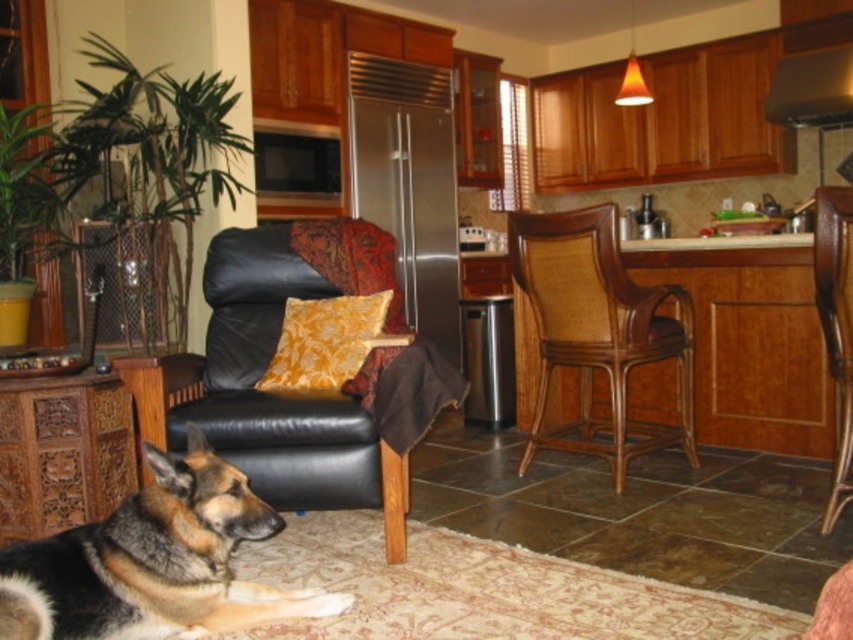
Does brown fur dog at lower left appear on the right side of brown woven wood chair at center?

No, brown fur dog at lower left is not to the right of brown woven wood chair at center.

Which is in front, point (22, 616) or point (645, 355)?

Point (22, 616) is in front.

Describe the element at coordinates (154, 561) in the screenshot. This screenshot has height=640, width=853. I see `brown fur dog at lower left` at that location.

Locate an element on the screen. Image resolution: width=853 pixels, height=640 pixels. brown fur dog at lower left is located at coordinates (154, 561).

Between brown woven wood chair at center and stainless steel exhaust hood at upper right, which one appears on the right side from the viewer's perspective?

stainless steel exhaust hood at upper right

Is brown woven wood chair at center shorter than stainless steel exhaust hood at upper right?

No, brown woven wood chair at center is not shorter than stainless steel exhaust hood at upper right.

Between point (641, 349) and point (820, 92), which one is positioned in front?

Point (641, 349) is more forward.

I want to click on brown woven wood chair at center, so click(596, 332).

From the picture: Is the position of brown fur dog at lower left more distant than that of yellow floral pillow at center?

No, brown fur dog at lower left is in front of yellow floral pillow at center.

How far apart are brown fur dog at lower left and yellow floral pillow at center?

29.09 inches

Locate an element on the screen. brown fur dog at lower left is located at coordinates (154, 561).